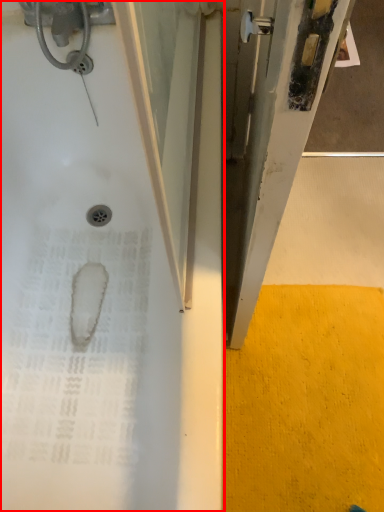
Question: From the image's perspective, what is the correct spatial positioning of bathtub (annotated by the red box) in reference to concrete?

Choices:
 (A) above
 (B) below

Answer: (A)